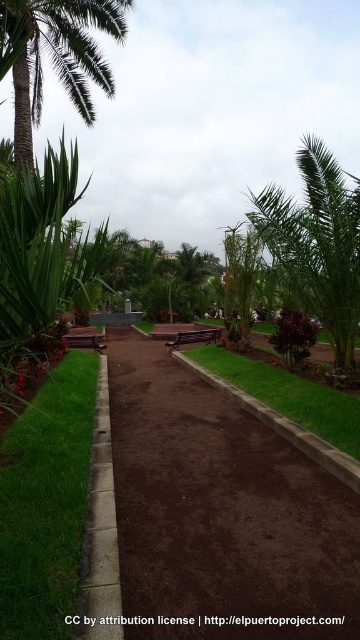
You are planning to install a new lighting system along the park pathway. The lights need to be placed at a height that won not interfere with the green leafy palm tree at upper right or block the view of the green turf at center. Considering their heights, which object requires the lights to be installed higher?

The green leafy palm tree at upper right requires the lights to be installed higher because it has a greater height compared to the green turf at center.

You are standing at the entrance of the park and notice the green grass at lower left. Can you determine its exact coordinates in the image?

The green grass at lower left is located at point (46, 502).